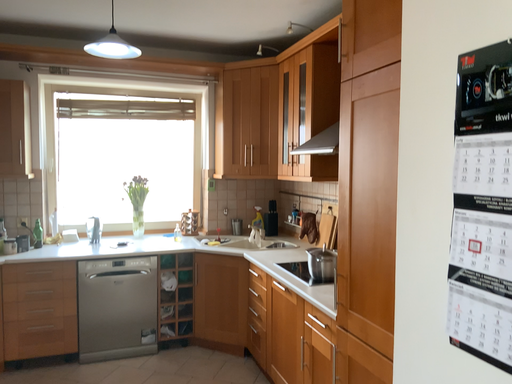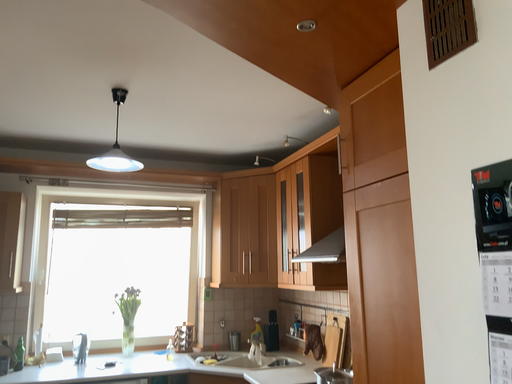
Question: How did the camera likely rotate when shooting the video?

Choices:
 (A) rotated downward
 (B) rotated upward

Answer: (B)